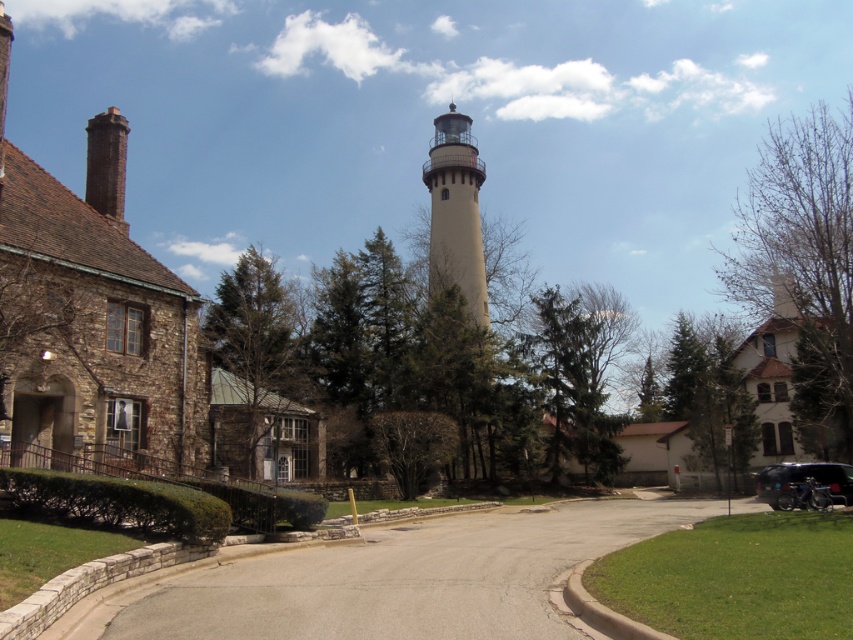
Is gray asphalt driveway at center to the left of beige stucco tower at center from the viewer's perspective?

In fact, gray asphalt driveway at center is to the right of beige stucco tower at center.

Does gray asphalt driveway at center appear under beige stucco tower at center?

Yes.

This screenshot has height=640, width=853. In order to click on gray asphalt driveway at center in this screenshot , I will do `click(387, 579)`.